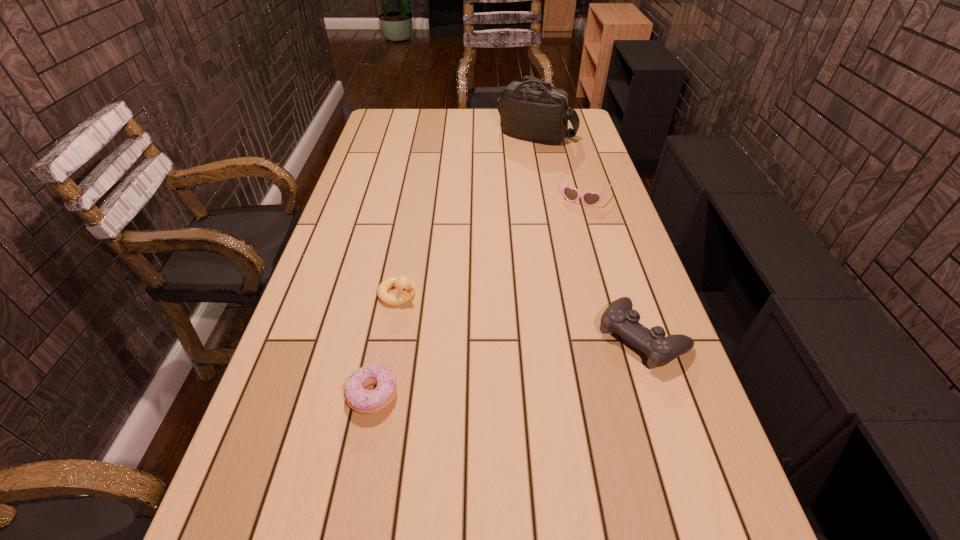
The width and height of the screenshot is (960, 540). Find the location of `shoulder bag that is positioned at the right edge`. shoulder bag that is positioned at the right edge is located at coordinates (538, 113).

Find the location of `object at the far right corner`. object at the far right corner is located at coordinates (538, 113).

I want to click on free space at the far edge of the desktop, so click(x=441, y=131).

Find the location of a particular element. free space at the near edge of the desktop is located at coordinates (x=455, y=458).

Where is `vacant space at the left edge of the desktop`? This screenshot has width=960, height=540. vacant space at the left edge of the desktop is located at coordinates (372, 204).

Find the location of a particular element. vacant space at the right edge of the desktop is located at coordinates (583, 181).

Identify the location of vacant space at the far left corner of the desktop. The height and width of the screenshot is (540, 960). (407, 120).

The image size is (960, 540). In order to click on vacant position at the near right corner of the desktop in this screenshot , I will do `click(672, 483)`.

Identify the location of vacant area that lies between the control and the doughnut. The height and width of the screenshot is (540, 960). (508, 366).

The width and height of the screenshot is (960, 540). I want to click on free space between the fourth nearest object and the doughnut, so click(479, 296).